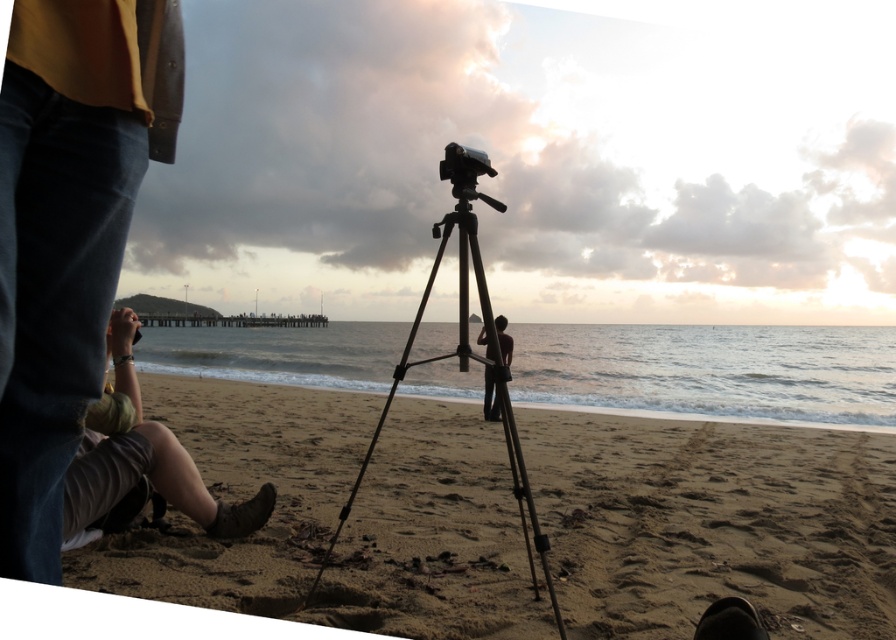
Question: Can you confirm if sandy beach at lower center is smaller than metallic tripod at center?

Choices:
 (A) yes
 (B) no

Answer: (B)

Question: Among these points, which one is farthest from the camera?

Choices:
 (A) (518, 573)
 (B) (468, 224)

Answer: (A)

Question: Can you confirm if sandy beach at lower center is thinner than metallic tripod at center?

Choices:
 (A) yes
 (B) no

Answer: (B)

Question: Is sandy beach at lower center positioned behind dark brown leather pants at center?

Choices:
 (A) yes
 (B) no

Answer: (A)

Question: Which of the following is the farthest from the observer?

Choices:
 (A) tap(139, 532)
 (B) tap(553, 611)
 (C) tap(503, 360)

Answer: (C)

Question: Estimate the real-world distances between objects in this image. Which object is closer to the dark brown leather pants at center?

Choices:
 (A) sandy beach at lower center
 (B) metallic tripod at center

Answer: (A)